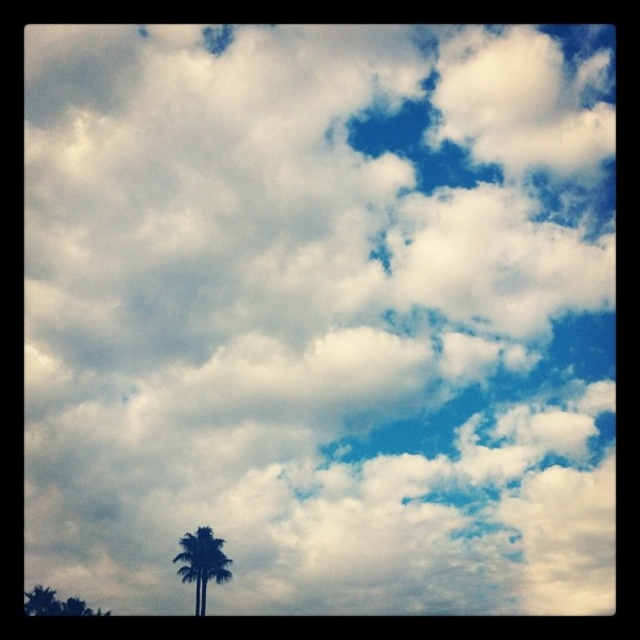
You are a bird flying over the scene and want to land on the widest tree. Which tree should you choose between the green leafy palm tree at lower center and the green leafy tree at lower left?

The green leafy palm tree at lower center is wider than the green leafy tree at lower left, so you should choose the green leafy palm tree at lower center to land on.

You are standing in a garden and want to water both the green leafy palm tree at lower center and the green leafy tree at lower left. Which tree should you water first if you want to start with the one closer to you?

You should water the green leafy palm tree at lower center first because it is closer to the viewer than the green leafy tree at lower left.

You are standing at the center of the image and want to walk towards the nearest tree. Which tree should you head towards, the green leafy palm tree at lower center or the green leafy tree at lower left?

The green leafy palm tree at lower center is 12.99 meters away from the green leafy tree at lower left. Since you are at the center, the distance to each tree would depend on their positions. However, without specific distances from your current position, it is impossible to determine which is closer. Please provide more information about your location relative to the trees.